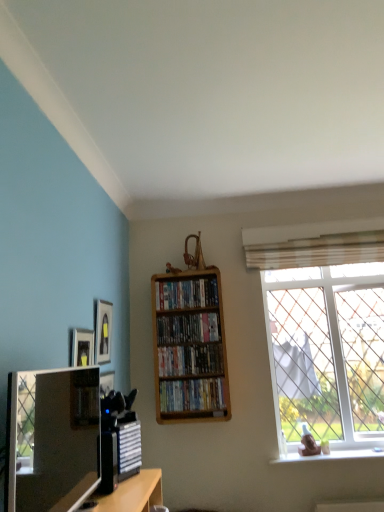
What is the approximate width of wooden bookcase at center?

6.32 inches.

What do you see at coordinates (190, 359) in the screenshot?
I see `wooden bookshelf at center, which ranks as the 2th book in bottom-to-top order` at bounding box center [190, 359].

What is the approximate width of wooden bookshelf at center, the third book viewed from the top?

It is 7.73 inches.

What is the approximate height of wooden bookshelf at center, marked as the first book in a bottom-to-top arrangement?

It is 7.87 inches.

The height and width of the screenshot is (512, 384). Describe the element at coordinates (102, 331) in the screenshot. I see `matte black picture frame at upper left` at that location.

Describe the element at coordinates (188, 328) in the screenshot. The height and width of the screenshot is (512, 384). I see `matte plastic dvds at center, the second book viewed from the top` at that location.

This screenshot has height=512, width=384. I want to click on satin black tv at lower left, so click(x=55, y=441).

This screenshot has height=512, width=384. In order to click on wooden bookcase at center in this screenshot , I will do `click(189, 347)`.

Between wooden bookshelf at center, the fourth book from the top, and satin black tv at lower left, which one has more height?

With more height is satin black tv at lower left.

Visually, is wooden bookshelf at center, the fourth book from the top, positioned to the left or to the right of satin black tv at lower left?

wooden bookshelf at center, the fourth book from the top, is positioned on satin black tv at lower left's right side.

Considering the relative sizes of wooden bookshelf at center, the fourth book from the top, and satin black tv at lower left in the image provided, is wooden bookshelf at center, the fourth book from the top, wider than satin black tv at lower left?

No.

Is wooden bookshelf at center, the fourth book from the top, facing away from satin black tv at lower left?

No, wooden bookshelf at center, the fourth book from the top, is not facing away from satin black tv at lower left.

In order to click on the 2nd book above the wooden bookcase at center (from the image's perspective) in this screenshot , I will do `click(186, 294)`.

Can you tell me how much wooden bookcase at center and wooden shelf at center, which is the fourth book from bottom to top, differ in facing direction?

3.14 degrees separate the facing orientations of wooden bookcase at center and wooden shelf at center, which is the fourth book from bottom to top.

Is wooden shelf at center, the 1th book from the top, a part of wooden bookcase at center?

Yes, wooden bookcase at center is surrounding wooden shelf at center, the 1th book from the top.

Who is taller, wooden bookcase at center or wooden shelf at center, the 1th book from the top?

Standing taller between the two is wooden bookcase at center.

From the image's perspective, between wooden shelf at center, the 1th book from the top, and matte black picture frame at upper left, who is located below?

From the image's view, matte black picture frame at upper left is below.

Does wooden shelf at center, which is the fourth book from bottom to top, come in front of matte black picture frame at upper left?

No, it is behind matte black picture frame at upper left.

Would you say wooden shelf at center, the 1th book from the top, is inside or outside matte black picture frame at upper left?

wooden shelf at center, the 1th book from the top, is spatially situated outside matte black picture frame at upper left.

Considering the sizes of wooden shelf at center, the 1th book from the top, and matte black picture frame at upper left in the image, is wooden shelf at center, the 1th book from the top, wider or thinner than matte black picture frame at upper left?

Considering their sizes, wooden shelf at center, the 1th book from the top, looks broader than matte black picture frame at upper left.

In the scene shown: Considering the relative positions of wooden bookshelf at center, the fourth book from the top, and matte plastic dvds at center, the second book viewed from the top, in the image provided, is wooden bookshelf at center, the fourth book from the top, to the right of matte plastic dvds at center, the second book viewed from the top, from the viewer's perspective?

Correct, you'll find wooden bookshelf at center, the fourth book from the top, to the right of matte plastic dvds at center, the second book viewed from the top.

Can you tell me how much wooden bookshelf at center, marked as the first book in a bottom-to-top arrangement, and matte plastic dvds at center, arranged as the 3th book when ordered from the bottom, differ in facing direction?

wooden bookshelf at center, marked as the first book in a bottom-to-top arrangement, and matte plastic dvds at center, arranged as the 3th book when ordered from the bottom, are facing 0.000983 degrees away from each other.

Is wooden bookshelf at center, the fourth book from the top, facing away from matte plastic dvds at center, arranged as the 3th book when ordered from the bottom?

No, wooden bookshelf at center, the fourth book from the top, is not facing away from matte plastic dvds at center, arranged as the 3th book when ordered from the bottom.

Consider the image. Considering the relative sizes of wooden bookshelf at center, the fourth book from the top, and matte plastic dvds at center, the second book viewed from the top, in the image provided, is wooden bookshelf at center, the fourth book from the top, thinner than matte plastic dvds at center, the second book viewed from the top,?

No, wooden bookshelf at center, the fourth book from the top, is not thinner than matte plastic dvds at center, the second book viewed from the top.

From a real-world perspective, is matte plastic dvds at center, the second book viewed from the top, positioned over wooden bookcase at center based on gravity?

Yes, from a real-world perspective, matte plastic dvds at center, the second book viewed from the top, is above wooden bookcase at center.

Is matte plastic dvds at center, arranged as the 3th book when ordered from the bottom, spatially inside wooden bookcase at center, or outside of it?

matte plastic dvds at center, arranged as the 3th book when ordered from the bottom, can be found inside wooden bookcase at center.

Could you tell me if matte plastic dvds at center, the second book viewed from the top, is facing wooden bookcase at center?

Yes, matte plastic dvds at center, the second book viewed from the top, is facing wooden bookcase at center.

From their relative heights in the image, would you say matte plastic dvds at center, the second book viewed from the top, is taller or shorter than wooden bookcase at center?

Clearly, matte plastic dvds at center, the second book viewed from the top, is shorter compared to wooden bookcase at center.

From a real-world perspective, is satin black tv at lower left positioned above or below wooden bookcase at center?

satin black tv at lower left is below wooden bookcase at center.

How different are the orientations of satin black tv at lower left and wooden bookcase at center in degrees?

The facing directions of satin black tv at lower left and wooden bookcase at center are 90.7 degrees apart.

Is point (93, 393) positioned before point (178, 381)?

That is True.

Between satin black tv at lower left and wooden bookcase at center, which one appears on the right side from the viewer's perspective?

wooden bookcase at center is more to the right.

Would you say wooden shelf at center, the 1th book from the top, is inside or outside wooden bookcase at center?

wooden shelf at center, the 1th book from the top, fits inside wooden bookcase at center.

From the image's perspective, which one is positioned higher, wooden shelf at center, which is the fourth book from bottom to top, or wooden bookcase at center?

wooden shelf at center, which is the fourth book from bottom to top.

Can you tell me how much wooden shelf at center, the 1th book from the top, and wooden bookcase at center differ in facing direction?

wooden shelf at center, the 1th book from the top, and wooden bookcase at center are facing 3.14 degrees away from each other.

From the picture: Is wooden shelf at center, the 1th book from the top, placed right next to wooden bookcase at center?

No, wooden shelf at center, the 1th book from the top, is not with wooden bookcase at center.

In the image, there is a wooden bookshelf at center, marked as the first book in a bottom-to-top arrangement. Identify the location of shelf below it (from a real-world perspective). (55, 441).

Locate an element on the screen. the 2nd book to the left of the wooden bookcase at center, counting from the anchor's position is located at coordinates (186, 294).

When comparing their distances from wooden bookcase at center, does wooden bookshelf at center, the fourth book from the top, or wooden shelf at center, which is the fourth book from bottom to top, seem closer?

The object closer to wooden bookcase at center is wooden bookshelf at center, the fourth book from the top.

From the image, which object appears to be nearer to wooden bookcase at center, matte plastic dvds at center, arranged as the 3th book when ordered from the bottom, or wooden shelf at center, the 1th book from the top?

matte plastic dvds at center, arranged as the 3th book when ordered from the bottom, lies closer to wooden bookcase at center than the other object.

Based on the photo, from the image, which object appears to be nearer to matte black picture frame at upper left, wooden bookshelf at center, which ranks as the 2th book in bottom-to-top order, or wooden shelf at center, the 1th book from the top?

wooden shelf at center, the 1th book from the top, is positioned closer to the anchor matte black picture frame at upper left.

Which object lies nearer to the anchor point matte black picture frame at upper left, clear glass window at right or wooden bookshelf at center, the third book viewed from the top?

wooden bookshelf at center, the third book viewed from the top, lies closer to matte black picture frame at upper left than the other object.

In the scene shown: From the image, which object appears to be farther from matte black picture frame at upper left, wooden bookshelf at center, which ranks as the 2th book in bottom-to-top order, or clear glass window at right?

clear glass window at right lies further to matte black picture frame at upper left than the other object.

Based on the photo, estimate the real-world distances between objects in this image. Which object is further from wooden bookshelf at center, the fourth book from the top, matte black picture frame at upper left or wooden bookcase at center?

matte black picture frame at upper left is further to wooden bookshelf at center, the fourth book from the top.

From the image, which object appears to be nearer to matte black picture frame at upper left, wooden bookcase at center or wooden bookshelf at center, marked as the first book in a bottom-to-top arrangement?

wooden bookcase at center is closer to matte black picture frame at upper left.

From the image, which object appears to be nearer to wooden bookshelf at center, the third book viewed from the top, matte plastic dvds at center, the second book viewed from the top, or wooden shelf at center, which is the fourth book from bottom to top?

Based on the image, matte plastic dvds at center, the second book viewed from the top, appears to be nearer to wooden bookshelf at center, the third book viewed from the top.

The width and height of the screenshot is (384, 512). Identify the location of bookcase between matte plastic dvds at center, arranged as the 3th book when ordered from the bottom, and clear glass window at right, in the horizontal direction. (189, 347).

Where is `bookcase between wooden shelf at center, which is the fourth book from bottom to top, and wooden bookshelf at center, marked as the first book in a bottom-to-top arrangement, in the vertical direction`? Image resolution: width=384 pixels, height=512 pixels. bookcase between wooden shelf at center, which is the fourth book from bottom to top, and wooden bookshelf at center, marked as the first book in a bottom-to-top arrangement, in the vertical direction is located at coordinates (189, 347).

The width and height of the screenshot is (384, 512). What are the coordinates of `book between matte plastic dvds at center, the second book viewed from the top, and wooden bookshelf at center, marked as the first book in a bottom-to-top arrangement, vertically` in the screenshot? It's located at (190, 359).

Image resolution: width=384 pixels, height=512 pixels. I want to click on bookcase located between matte black picture frame at upper left and matte plastic dvds at center, the second book viewed from the top, in the depth direction, so click(189, 347).